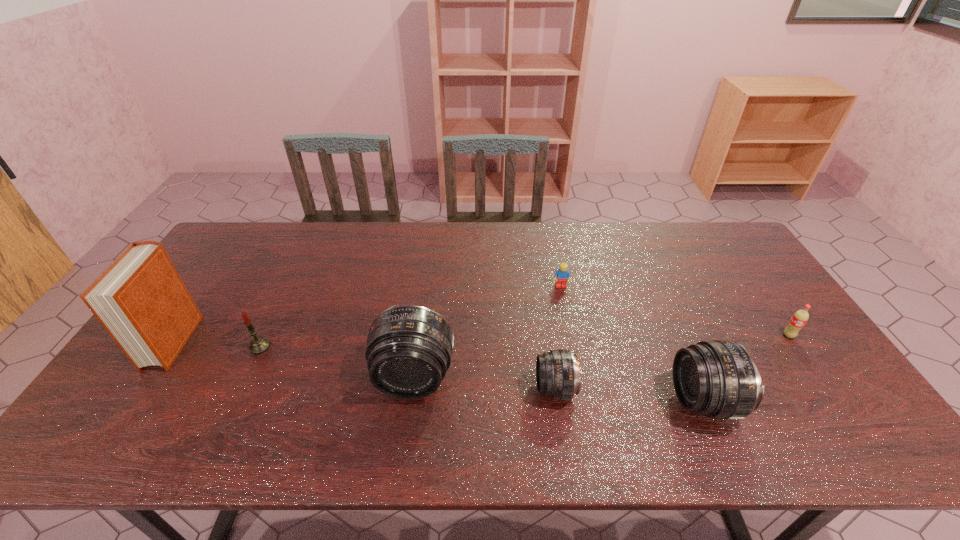
With all telephoto lenss evenly spaced, where should an extra telephoto lens be placed on the right to continue the pattern? Please point out a vacant space. Please provide its 2D coordinates. Your answer should be formatted as a tuple, i.e. [(x, y)], where the tuple contains the x and y coordinates of a point satisfying the conditions above.

[(859, 414)]